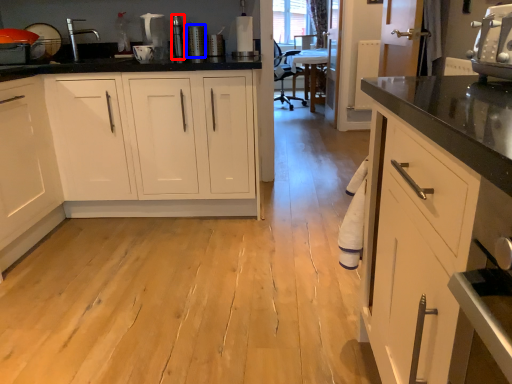
Question: Which of the following is the farthest to the observer, appliance (highlighted by a red box) or appliance (highlighted by a blue box)?

Choices:
 (A) appliance
 (B) appliance

Answer: (A)